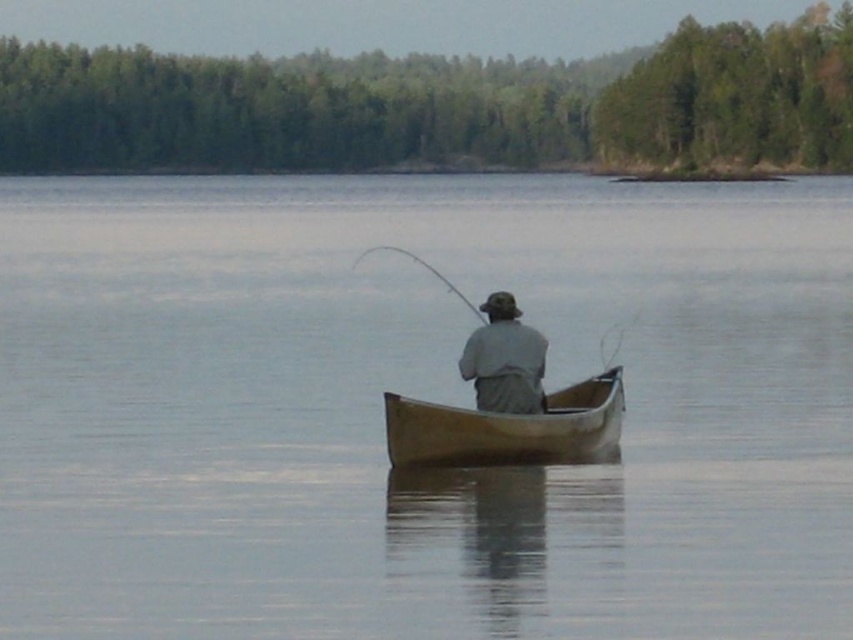
You are a photographer trying to capture the gray fabric fisherman at center and the flexible fiberglass rod at center in a single shot. Based on their positions, which object is closer to the right edge of the photo?

The gray fabric fisherman at center is positioned on the right side of the flexible fiberglass rod at center, so the gray fabric fisherman at center is closer to the right edge of the photo.

You are planning to fish in the boat and want to ensure your fishing rod won not fall into the water. Considering the clear water at center and the flexible fiberglass rod at center, which one is wider?

The clear water at center is wider than the flexible fiberglass rod at center, so the rod will not fall into the water as the water is wider.